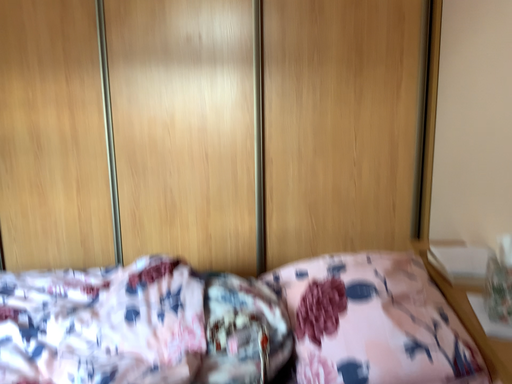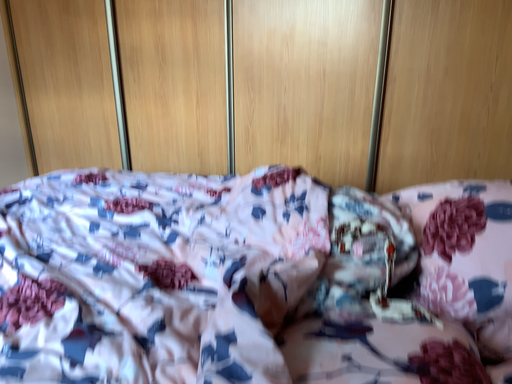
Question: Which way did the camera rotate in the video?

Choices:
 (A) rotated left
 (B) rotated right

Answer: (A)